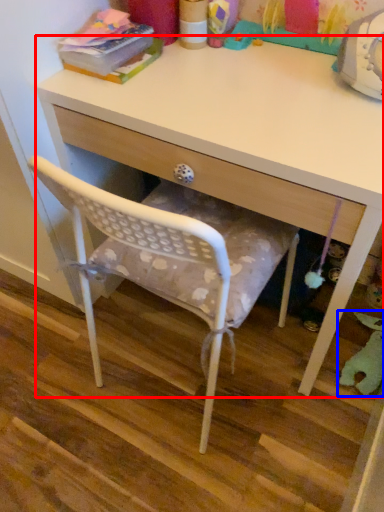
Question: Among these objects, which one is farthest to the camera, desk (highlighted by a red box) or toy (highlighted by a blue box)?

Choices:
 (A) desk
 (B) toy

Answer: (B)